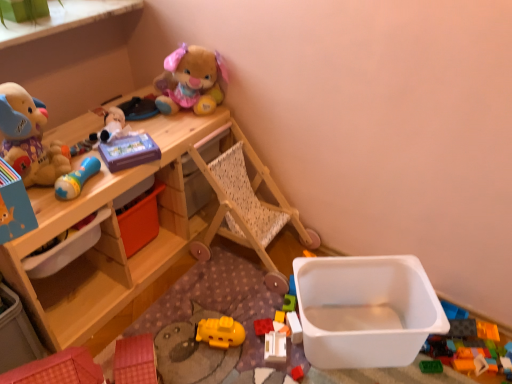
Where is `vacant space behind yellow plastic toy at center, the 5th toy positioned from the bottom`? vacant space behind yellow plastic toy at center, the 5th toy positioned from the bottom is located at coordinates (263, 291).